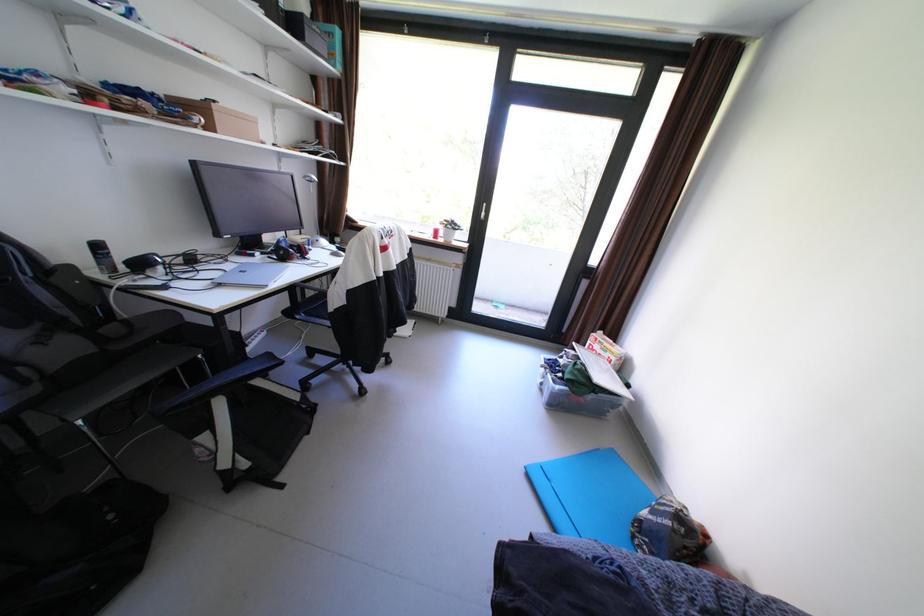
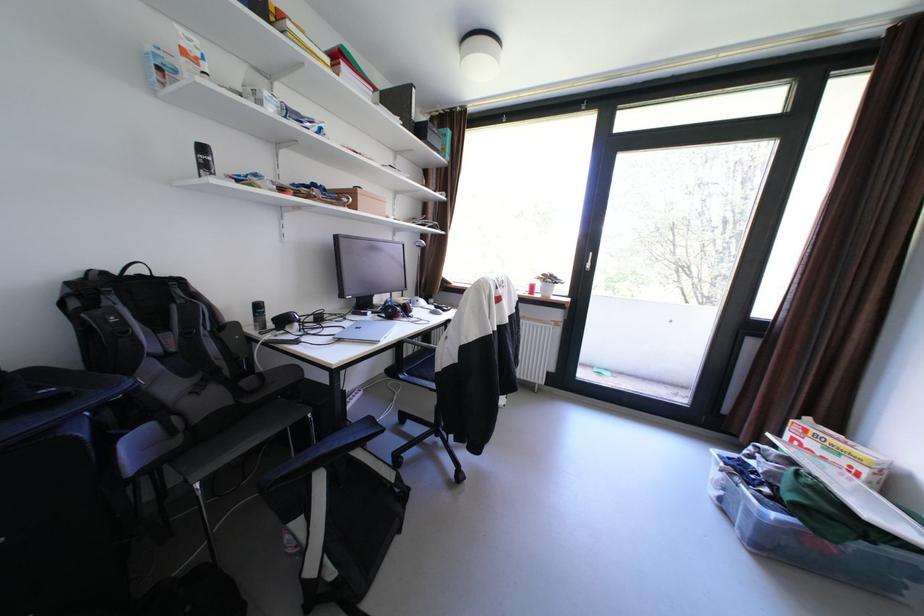
Question: I am providing you with two images of the same scene from different viewpoints. After the viewpoint changes to image2, which objects are now occluded?

Choices:
 (A) chair sitting surface
 (B) silver door handle
 (C) cardboard detergent box
 (D) none of these

Answer: (D)